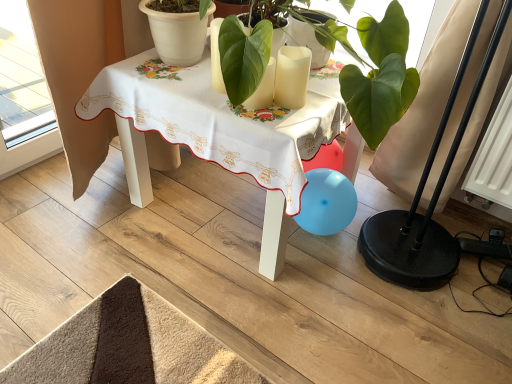
Find the location of a particular element. unoccupied area in front of white matte candle at center is located at coordinates (286, 115).